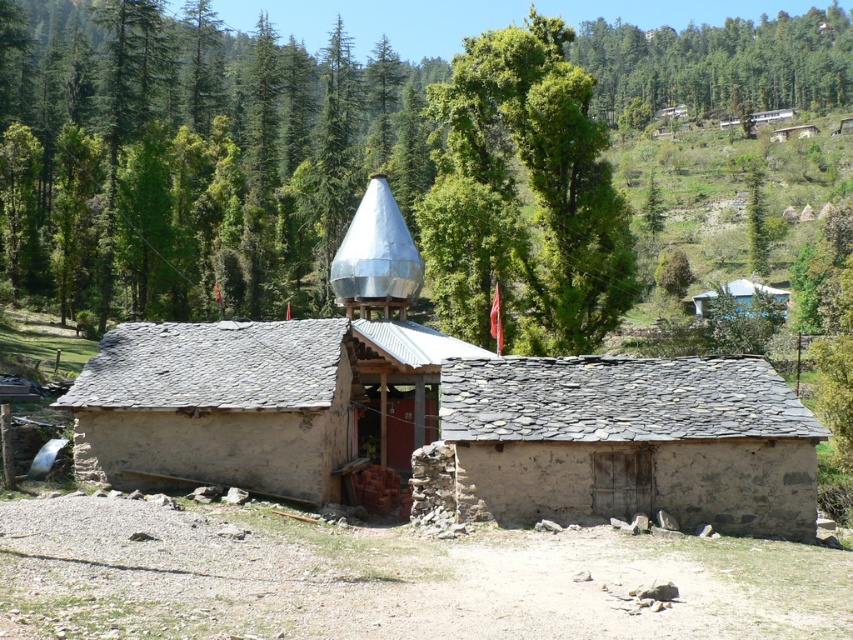
Question: Does gray stone hut at center appear over white painted wood hut at upper right?

Choices:
 (A) yes
 (B) no

Answer: (B)

Question: Which is nearer to the gray stone hut at center?

Choices:
 (A) green leafy tree at upper center
 (B) white painted wood hut at upper right
 (C) green leafy tree at upper right

Answer: (A)

Question: In this image, where is green leafy pine forest at upper center located relative to rustic stone hut at center?

Choices:
 (A) right
 (B) left

Answer: (B)

Question: Which point is farther to the camera?

Choices:
 (A) green leafy tree at upper center
 (B) gray stone hut at center

Answer: (A)

Question: Observing the image, what is the correct spatial positioning of green leafy pine forest at upper center in reference to gray stone hut at center?

Choices:
 (A) left
 (B) right

Answer: (A)

Question: Based on their relative distances, which object is farther from the white painted wood hut at upper right?

Choices:
 (A) green leafy tree at upper center
 (B) green leafy tree at upper right
 (C) green leafy pine forest at upper center

Answer: (B)